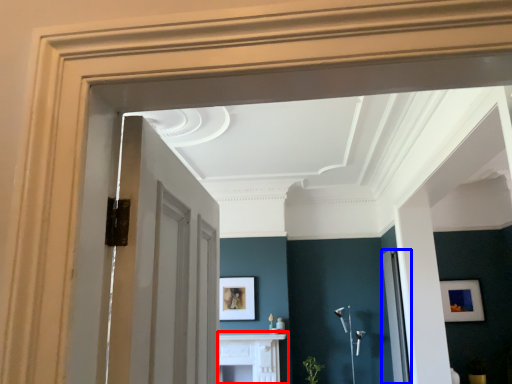
Question: Which point is closer to the camera, table (highlighted by a red box) or glass door (highlighted by a blue box)?

Choices:
 (A) table
 (B) glass door

Answer: (B)